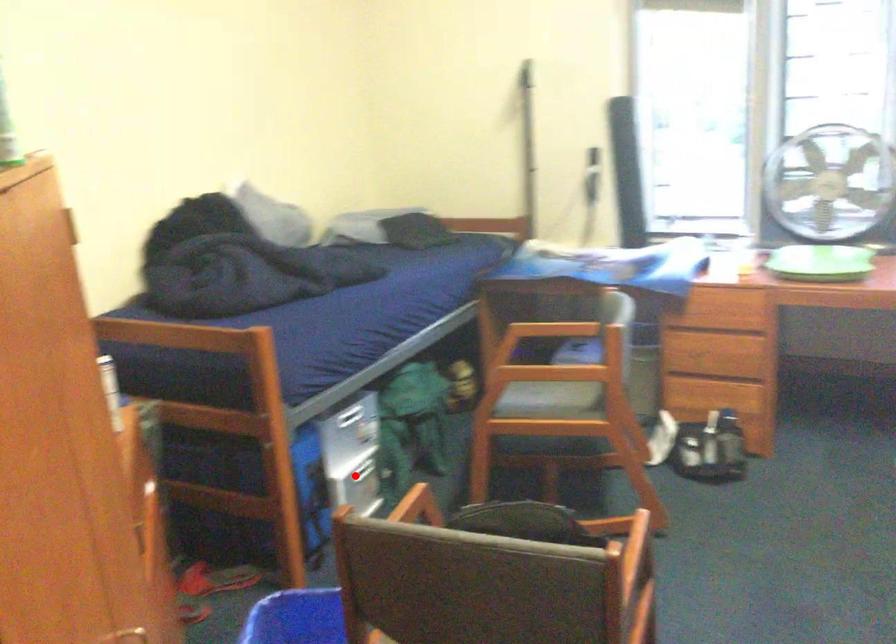
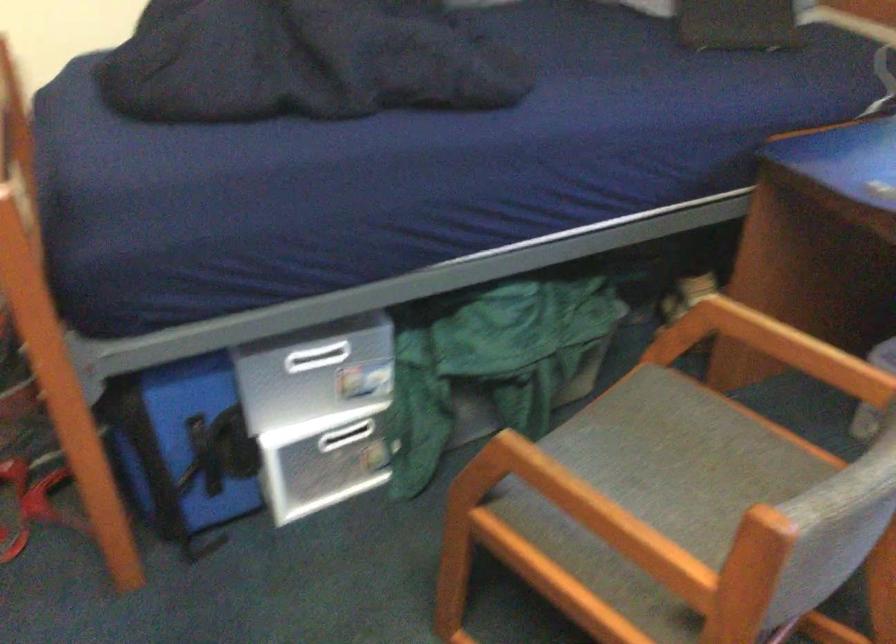
Question: I am providing you with two images of the same scene from different viewpoints. Given a red point in image1, look at the same physical point in image2. Is it:

Choices:
 (A) Closer to the viewpoint
 (B) Farther from the viewpoint

Answer: (A)